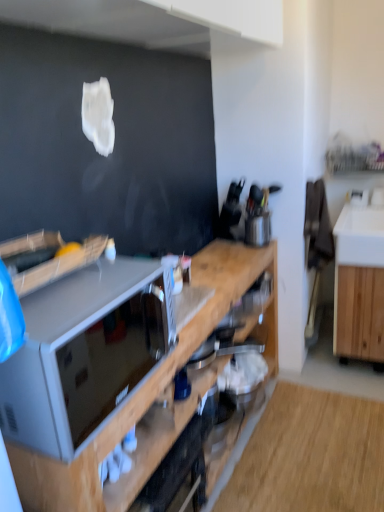
Question: Would you say wooden cabinet at right, the 1th cabinetry viewed from the right, contains wooden cabinet at center, which appears as the first cabinetry when viewed from the left?

Choices:
 (A) yes
 (B) no

Answer: (B)

Question: Can you confirm if wooden cabinet at right, positioned as the 2th cabinetry in left-to-right order, is shorter than wooden cabinet at center, placed as the second cabinetry when sorted from right to left?

Choices:
 (A) no
 (B) yes

Answer: (B)

Question: Is wooden cabinet at right, the 1th cabinetry viewed from the right, bigger than wooden cabinet at center, placed as the second cabinetry when sorted from right to left?

Choices:
 (A) yes
 (B) no

Answer: (B)

Question: Does wooden cabinet at right, the 1th cabinetry viewed from the right, come behind wooden cabinet at center, which appears as the first cabinetry when viewed from the left?

Choices:
 (A) yes
 (B) no

Answer: (A)

Question: From a real-world perspective, is wooden cabinet at right, the 1th cabinetry viewed from the right, on top of wooden cabinet at center, placed as the second cabinetry when sorted from right to left?

Choices:
 (A) no
 (B) yes

Answer: (A)

Question: From a real-world perspective, is matte gray microwave at center positioned above or below wooden cabinet at center, placed as the second cabinetry when sorted from right to left?

Choices:
 (A) below
 (B) above

Answer: (B)

Question: Based on their sizes in the image, would you say matte gray microwave at center is bigger or smaller than wooden cabinet at center, placed as the second cabinetry when sorted from right to left?

Choices:
 (A) big
 (B) small

Answer: (B)

Question: Relative to wooden cabinet at center, which appears as the first cabinetry when viewed from the left, is matte gray microwave at center in front or behind?

Choices:
 (A) front
 (B) behind

Answer: (A)

Question: In terms of height, does matte gray microwave at center look taller or shorter compared to wooden cabinet at center, placed as the second cabinetry when sorted from right to left?

Choices:
 (A) tall
 (B) short

Answer: (B)

Question: Is matte gray microwave at center taller or shorter than metallic silver toaster at center, which is the first appliance in bottom-to-top order?

Choices:
 (A) tall
 (B) short

Answer: (A)

Question: Is matte gray microwave at center inside or outside of metallic silver toaster at center, marked as the 2th appliance in a right-to-left arrangement?

Choices:
 (A) outside
 (B) inside

Answer: (A)

Question: In terms of width, does matte gray microwave at center look wider or thinner when compared to metallic silver toaster at center, which is counted as the 1th appliance, starting from the left?

Choices:
 (A) thin
 (B) wide

Answer: (B)

Question: From the image's perspective, is matte gray microwave at center located above or below metallic silver toaster at center, which is counted as the 1th appliance, starting from the left?

Choices:
 (A) below
 (B) above

Answer: (B)

Question: Based on their sizes in the image, would you say wooden cabinet at center, which appears as the first cabinetry when viewed from the left, is bigger or smaller than wooden cabinet at right, the 1th cabinetry viewed from the right?

Choices:
 (A) big
 (B) small

Answer: (A)

Question: From a real-world perspective, relative to wooden cabinet at right, the 1th cabinetry viewed from the right, is wooden cabinet at center, placed as the second cabinetry when sorted from right to left, vertically above or below?

Choices:
 (A) below
 (B) above

Answer: (B)